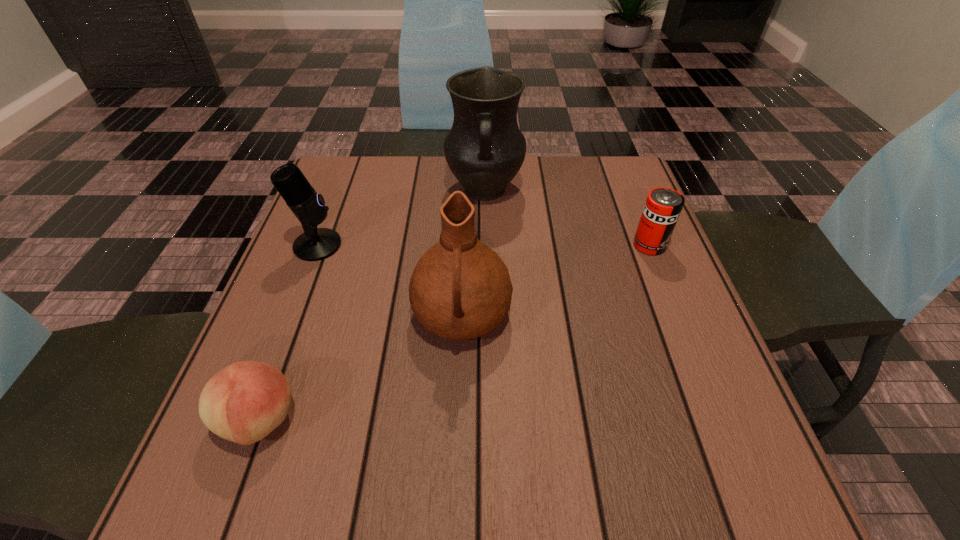
At what (x,y) coordinates should I click in order to perform the action: click on vacant space at the left edge. Please return your answer as a coordinate pair (x, y). Looking at the image, I should click on (328, 222).

The image size is (960, 540). In the image, there is a desktop. In order to click on vacant space at the right edge in this screenshot , I will do `click(621, 228)`.

The image size is (960, 540). What are the coordinates of `vacant space at the far left corner of the desktop` in the screenshot? It's located at (355, 163).

I want to click on vacant space at the far right corner of the desktop, so click(595, 187).

At what (x,y) coordinates should I click in order to perform the action: click on vacant area that lies between the rightmost object and the second nearest object. Please return your answer as a coordinate pair (x, y). The height and width of the screenshot is (540, 960). Looking at the image, I should click on (556, 280).

In order to click on vacant area between the nearer pitcher and the third tallest object in this screenshot , I will do `click(390, 280)`.

Image resolution: width=960 pixels, height=540 pixels. I want to click on empty location between the peach and the farther pitcher, so click(372, 305).

Where is `free spot between the can and the farthest object`? This screenshot has height=540, width=960. free spot between the can and the farthest object is located at coordinates (567, 218).

I want to click on vacant space that is in between the farther pitcher and the can, so click(567, 218).

You are a GUI agent. You are given a task and a screenshot of the screen. Output one action in this format:
    pyautogui.click(x=<x>, y=<y>)
    Task: Click on the free area in between the farther pitcher and the second shortest object
    This screenshot has width=960, height=540.
    Given the screenshot: What is the action you would take?
    pyautogui.click(x=567, y=218)